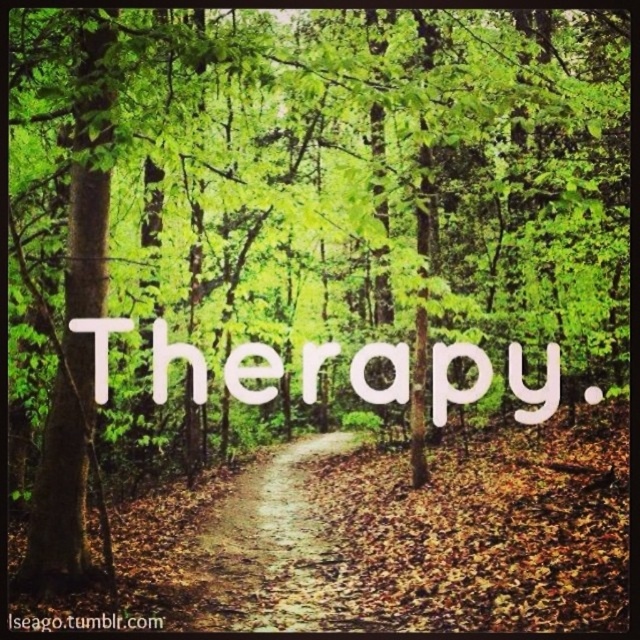
Question: Is brown dirt path at center to the right of white paper text at center from the viewer's perspective?

Choices:
 (A) yes
 (B) no

Answer: (B)

Question: Does white paper text at center have a lesser width compared to white matte text at center?

Choices:
 (A) no
 (B) yes

Answer: (A)

Question: Which object is the closest to the white matte text at center?

Choices:
 (A) brown dirt path at center
 (B) white paper text at center

Answer: (B)

Question: Which of these objects is positioned closest to the white matte text at center?

Choices:
 (A) brown dirt path at center
 (B) white paper text at center

Answer: (B)

Question: Which point is closer to the camera taking this photo?

Choices:
 (A) (298, 579)
 (B) (20, 625)

Answer: (B)

Question: Does white paper text at center appear on the left side of white matte text at center?

Choices:
 (A) no
 (B) yes

Answer: (A)